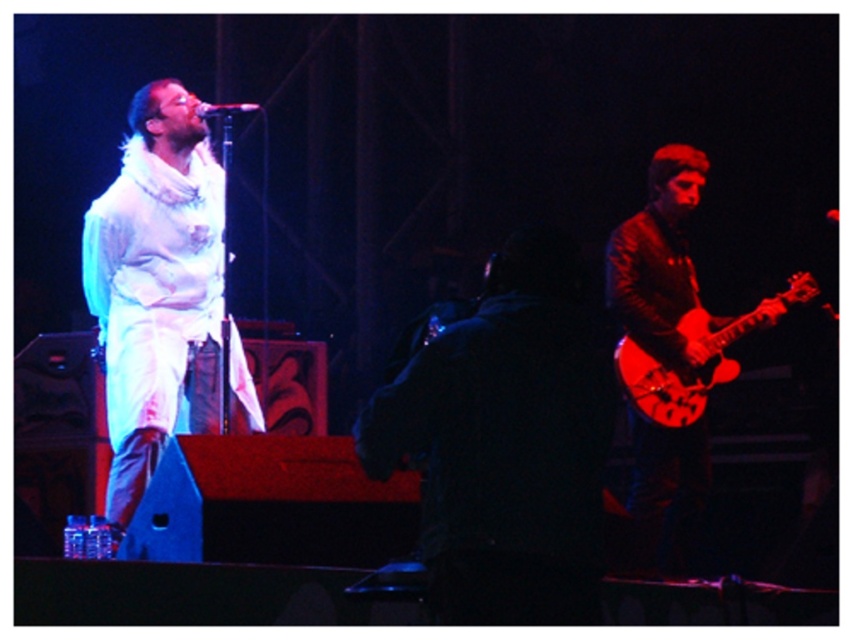
What do you see at coordinates (660, 262) in the screenshot?
I see `shiny brown leather guitar at right` at bounding box center [660, 262].

From the picture: Is shiny brown leather guitar at right closer to camera compared to glossy wood guitar at right?

Yes, it is in front of glossy wood guitar at right.

Does point (611, 305) come farther from viewer compared to point (664, 401)?

Yes, it is behind point (664, 401).

The height and width of the screenshot is (640, 853). What are the coordinates of `shiny brown leather guitar at right` in the screenshot? It's located at (660, 262).

Which is more to the right, white cotton shirt at left or glossy wood guitar at right?

glossy wood guitar at right is more to the right.

Is point (193, 125) positioned in front of point (703, 312)?

Yes, it is.

The width and height of the screenshot is (853, 640). Describe the element at coordinates (155, 288) in the screenshot. I see `white cotton shirt at left` at that location.

Where is `white cotton shirt at left`? The width and height of the screenshot is (853, 640). white cotton shirt at left is located at coordinates (155, 288).

Between shiny brown leather guitar at right and metallic silver microphone at upper center, which one is positioned lower?

shiny brown leather guitar at right is below.

What are the coordinates of `shiny brown leather guitar at right` in the screenshot? It's located at (660, 262).

In order to click on shiny brown leather guitar at right in this screenshot , I will do `click(660, 262)`.